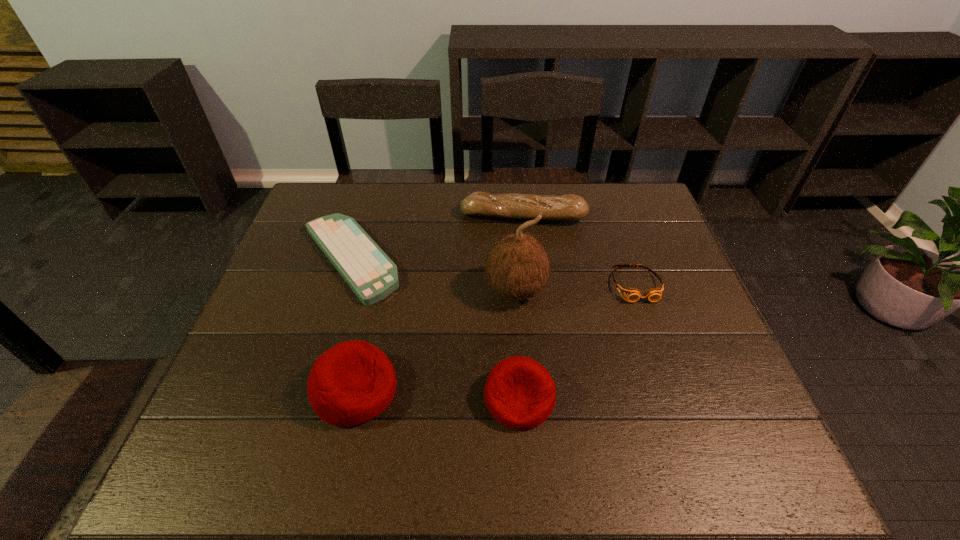
The image size is (960, 540). In order to click on vacant point at the left edge in this screenshot , I will do `click(276, 326)`.

Where is `blank space at the right edge of the desktop`? blank space at the right edge of the desktop is located at coordinates (686, 347).

You are a GUI agent. You are given a task and a screenshot of the screen. Output one action in this format:
    pyautogui.click(x=<x>, y=<y>)
    Task: Click on the vacant region at the far right corner of the desktop
    
    Given the screenshot: What is the action you would take?
    pyautogui.click(x=602, y=190)

I want to click on free space between the shortest object and the tallest object, so click(433, 274).

The image size is (960, 540). Find the location of `empty location between the second tallest object and the shorter beanbag`. empty location between the second tallest object and the shorter beanbag is located at coordinates (437, 394).

Locate an element on the screen. vacant area between the tallest object and the shorter beanbag is located at coordinates (517, 344).

Identify the location of free area in between the tallest object and the right beanbag. (517, 344).

The image size is (960, 540). What are the coordinates of `vacant area that lies between the coconut and the computer keyboard` in the screenshot? It's located at (433, 274).

Find the location of `blank region between the baguet and the shorter beanbag`. blank region between the baguet and the shorter beanbag is located at coordinates (521, 307).

Where is `empty location between the taller beanbag and the computer keyboard`? empty location between the taller beanbag and the computer keyboard is located at coordinates (352, 324).